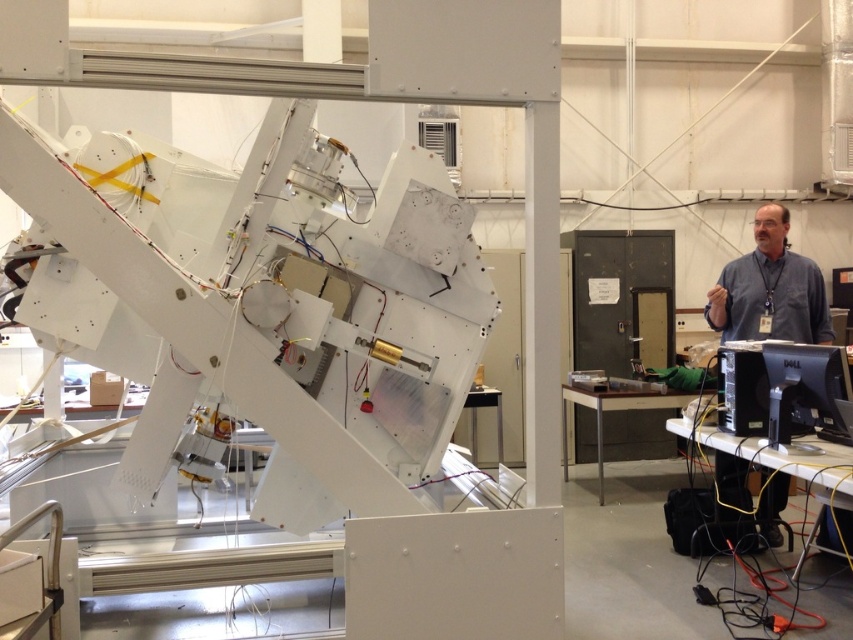
Is gray shirt at right wider than blue shirt at right?

In fact, gray shirt at right might be narrower than blue shirt at right.

Consider the image. Which is more to the right, gray shirt at right or blue shirt at right?

gray shirt at right

This screenshot has height=640, width=853. I want to click on gray shirt at right, so click(770, 289).

Locate an element on the screen. Image resolution: width=853 pixels, height=640 pixels. gray shirt at right is located at coordinates (770, 289).